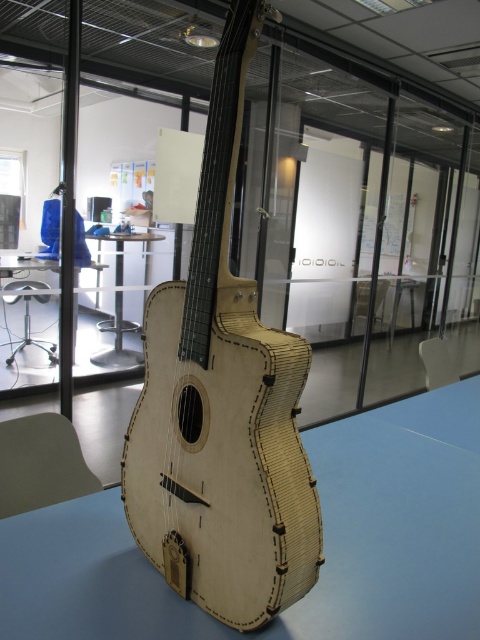
Question: Which object is closer to the camera taking this photo?

Choices:
 (A) light wood table at center
 (B) wooden table at center
 (C) natural wood guitar at center

Answer: (C)

Question: Which point is closer to the camera?

Choices:
 (A) (205, 385)
 (B) (437, 428)

Answer: (A)

Question: Is light wood table at center closer to camera compared to wooden table at center?

Choices:
 (A) yes
 (B) no

Answer: (A)

Question: Estimate the real-world distances between objects in this image. Which object is farther from the natural wood guitar at center?

Choices:
 (A) light wood table at center
 (B) wooden table at center

Answer: (B)

Question: Is natural wood guitar at center below light wood table at center?

Choices:
 (A) no
 (B) yes

Answer: (A)

Question: Is natural wood guitar at center smaller than wooden table at center?

Choices:
 (A) yes
 (B) no

Answer: (A)